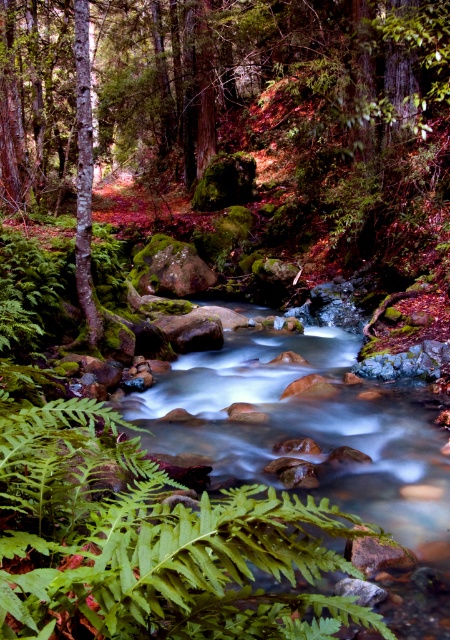
You are a hiker who wants to take a photo of the green leafy fern at lower left and the smooth bark tree at left. Which object is positioned to the right side of the other?

The green leafy fern at lower left is positioned to the right of the smooth bark tree at left.

You are a hiker who wants to take a photo of the green leafy fern at lower left and the smooth bark tree at left. Which object should you focus on first if you want to capture both in one shot without moving the camera?

The green leafy fern at lower left is shorter than the smooth bark tree at left, so you should focus on the green leafy fern at lower left first since it is closer to the camera.